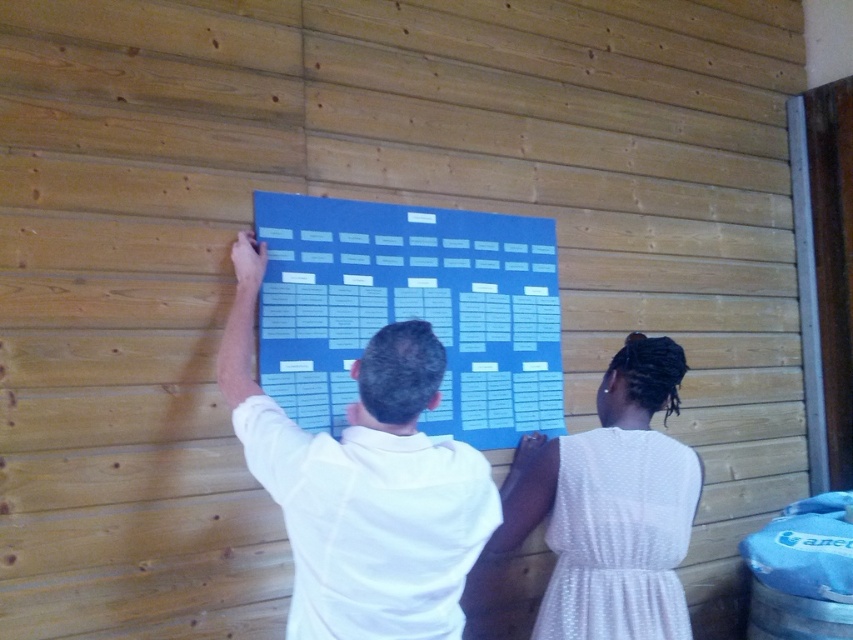
Question: Among these points, which one is nearest to the camera?

Choices:
 (A) (357, 563)
 (B) (291, 280)
 (C) (627, 586)

Answer: (A)

Question: Is blue paperboard at center positioned in front of white dotted dress at center?

Choices:
 (A) no
 (B) yes

Answer: (A)

Question: Can you confirm if white matte shirt at center is positioned to the right of white dotted dress at center?

Choices:
 (A) yes
 (B) no

Answer: (B)

Question: Estimate the real-world distances between objects in this image. Which object is farther from the white matte shirt at center?

Choices:
 (A) blue paperboard at center
 (B) white dotted dress at center

Answer: (B)

Question: Which point is farther from the camera taking this photo?

Choices:
 (A) (639, 577)
 (B) (425, 275)

Answer: (B)

Question: Does blue paperboard at center have a lesser width compared to white dotted dress at center?

Choices:
 (A) no
 (B) yes

Answer: (A)